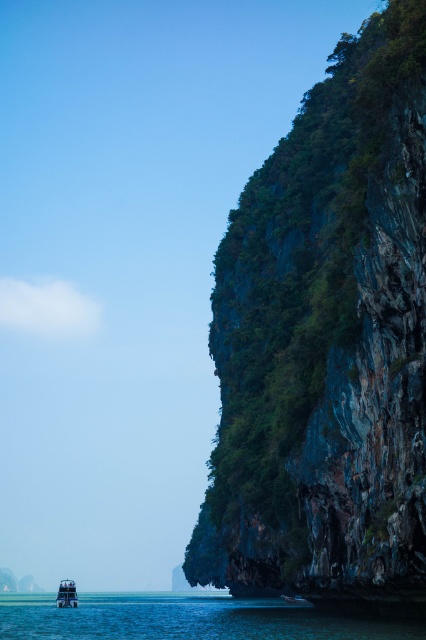
Question: Can you confirm if green rock cliff at right is wider than metallic silver boat at lower left?

Choices:
 (A) yes
 (B) no

Answer: (B)

Question: Which point is farther to the camera?

Choices:
 (A) (74, 595)
 (B) (273, 556)

Answer: (A)

Question: Estimate the real-world distances between objects in this image. Which object is closer to the metallic silver boat at lower left?

Choices:
 (A) green rock cliff at right
 (B) clear blue water at lower center

Answer: (B)

Question: Among these objects, which one is nearest to the camera?

Choices:
 (A) clear blue water at lower center
 (B) metallic silver boat at lower left
 (C) green rock cliff at right

Answer: (C)

Question: Does green rock cliff at right have a greater width compared to metallic silver boat at lower left?

Choices:
 (A) yes
 (B) no

Answer: (B)

Question: Does green rock cliff at right appear on the right side of metallic silver boat at lower left?

Choices:
 (A) no
 (B) yes

Answer: (B)